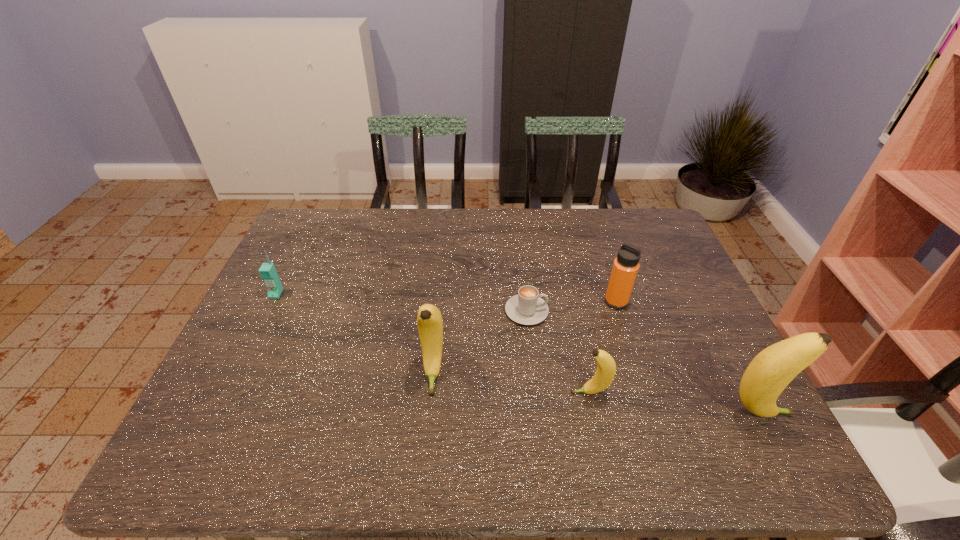
Please point a free position for a banana on the left. Please provide its 2D coordinates. Your answer should be formatted as a tuple, i.e. [(x, y)], where the tuple contains the x and y coordinates of a point satisfying the conditions above.

[(288, 355)]